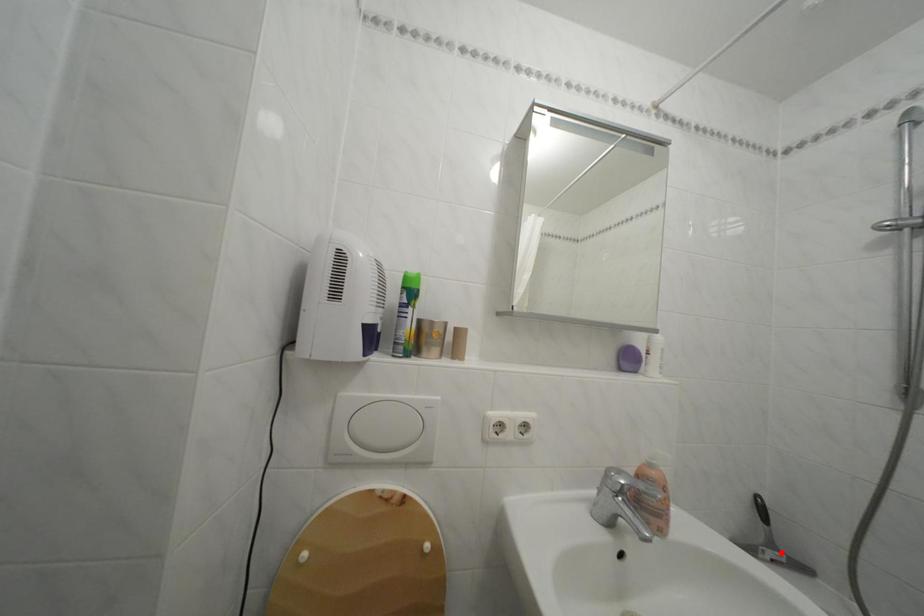
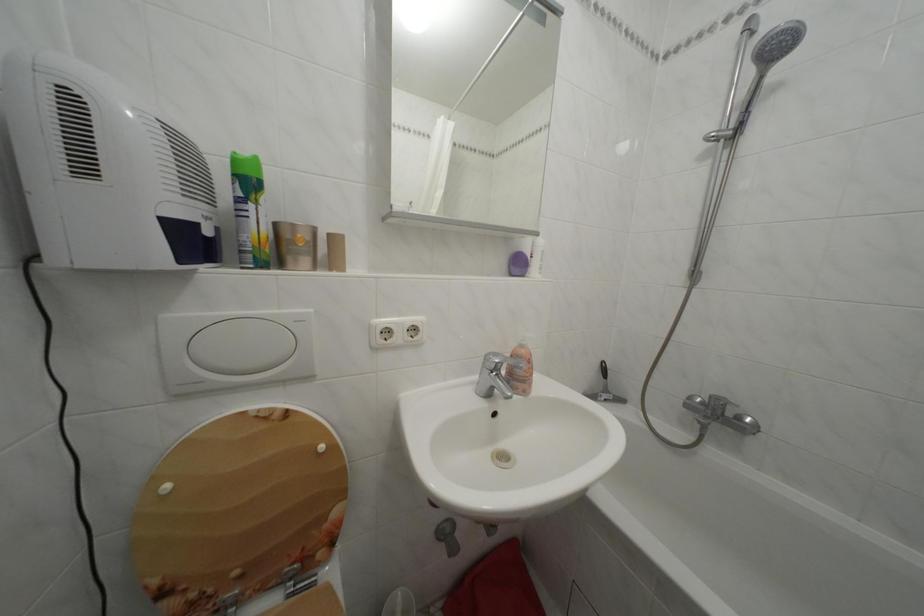
Where in the second image is the point corresponding to the highlighted location from the first image?

(614, 397)